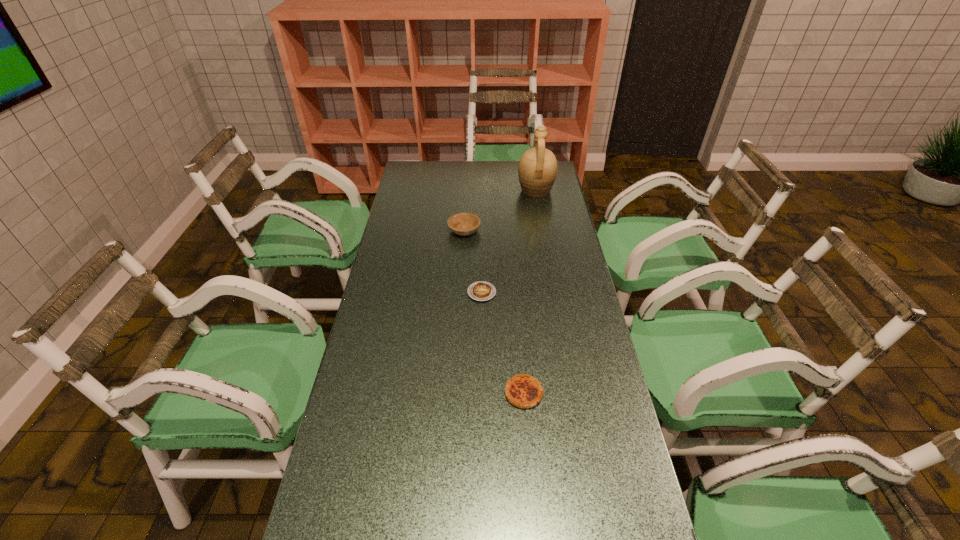
Locate an element on the screen. object that can be found as the third closest to the third farthest object is located at coordinates (537, 170).

This screenshot has height=540, width=960. Find the location of `free space that satisfies the following two spatial constraints: 1. on the front side of the third farthest object; 2. on the left side of the nearest object`. free space that satisfies the following two spatial constraints: 1. on the front side of the third farthest object; 2. on the left side of the nearest object is located at coordinates (482, 393).

Locate an element on the screen. The width and height of the screenshot is (960, 540). vacant position in the image that satisfies the following two spatial constraints: 1. on the back side of the farthest object; 2. on the right side of the nearer quiche is located at coordinates (507, 191).